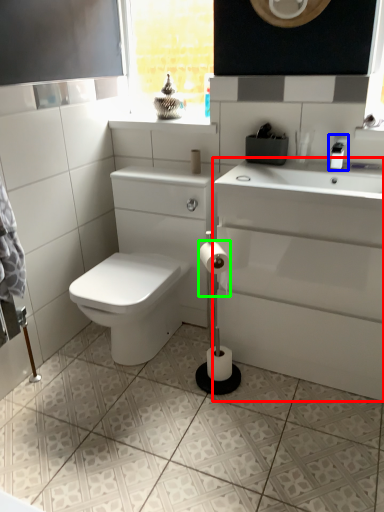
Question: Which object is positioned farthest from porcelain (highlighted by a red box)? Select from faucet (highlighted by a blue box) and toilet paper (highlighted by a green box).

Choices:
 (A) faucet
 (B) toilet paper

Answer: (A)